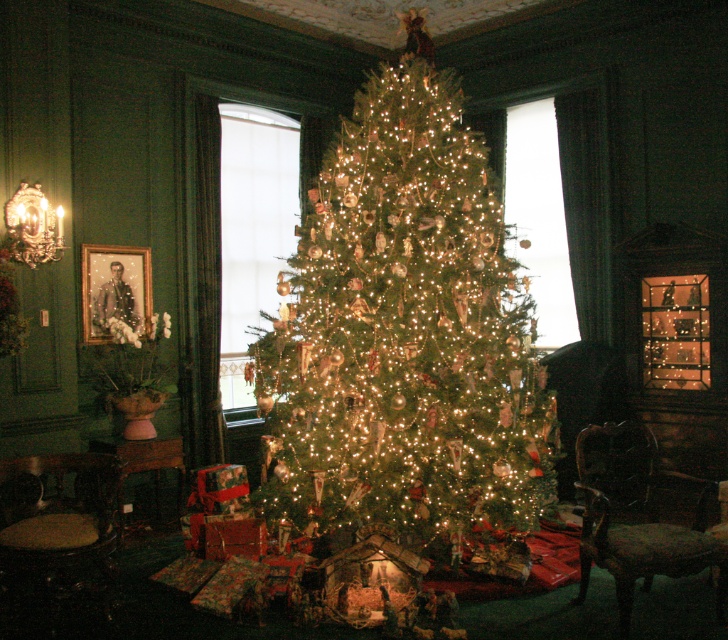
Question: Estimate the real-world distances between objects in this image. Which object is farther from the wooden armchair at lower right?

Choices:
 (A) dark brown leather armchair at lower left
 (B) green textured christmas tree at center

Answer: (A)

Question: Does wooden armchair at lower right have a lesser width compared to dark brown leather armchair at lower left?

Choices:
 (A) yes
 (B) no

Answer: (B)

Question: Is green textured christmas tree at center positioned behind dark brown leather armchair at lower left?

Choices:
 (A) no
 (B) yes

Answer: (B)

Question: Does green textured christmas tree at center have a greater width compared to wooden armchair at lower right?

Choices:
 (A) no
 (B) yes

Answer: (B)

Question: Which point is closer to the camera taking this photo?

Choices:
 (A) (609, 497)
 (B) (368, 420)

Answer: (B)

Question: Which object is positioned farthest from the green textured christmas tree at center?

Choices:
 (A) wooden armchair at lower right
 (B) dark brown leather armchair at lower left

Answer: (B)